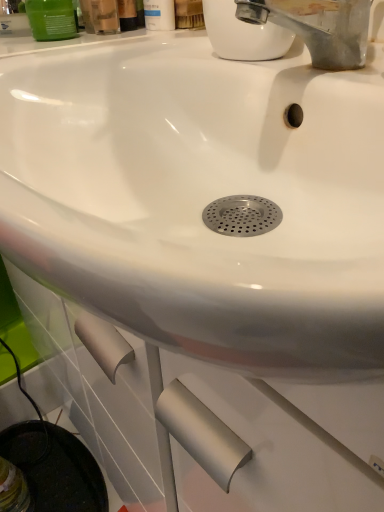
This screenshot has width=384, height=512. Describe the element at coordinates (100, 16) in the screenshot. I see `matte plastic mouthwash at upper center, positioned as the second mouthwash in left-to-right order` at that location.

Image resolution: width=384 pixels, height=512 pixels. What are the coordinates of `green matte container at upper left, marked as the 3th mouthwash in a right-to-left arrangement` in the screenshot? It's located at (51, 19).

Find the location of a particular element. The height and width of the screenshot is (512, 384). white matte bottle at upper center, the 1th mouthwash when ordered from right to left is located at coordinates (159, 15).

Is white matte bottle at upper center, the 1th mouthwash when ordered from right to left, touching green matte container at upper left, the 1th mouthwash positioned from the left?

There is a gap between white matte bottle at upper center, the 1th mouthwash when ordered from right to left, and green matte container at upper left, the 1th mouthwash positioned from the left.

Considering the relative sizes of white matte bottle at upper center, the 1th mouthwash when ordered from right to left, and green matte container at upper left, marked as the 3th mouthwash in a right-to-left arrangement, in the image provided, is white matte bottle at upper center, the 1th mouthwash when ordered from right to left, wider than green matte container at upper left, marked as the 3th mouthwash in a right-to-left arrangement,?

No.

From the image's perspective, starting from the white matte bottle at upper center, the 1th mouthwash when ordered from right to left, which mouthwash is the 2nd one below? Please provide its 2D coordinates.

[(51, 19)]

Between white matte bottle at upper center, the 1th mouthwash when ordered from right to left, and green matte container at upper left, marked as the 3th mouthwash in a right-to-left arrangement, which one has larger size?

Bigger between the two is white matte bottle at upper center, the 1th mouthwash when ordered from right to left.

Identify the location of mouthwash behind the green matte container at upper left, the 1th mouthwash positioned from the left. Image resolution: width=384 pixels, height=512 pixels. (159, 15).

Can you confirm if green matte container at upper left, the 1th mouthwash positioned from the left, is smaller than white matte bottle at upper center, the 1th mouthwash when ordered from right to left?

Yes, green matte container at upper left, the 1th mouthwash positioned from the left, is smaller than white matte bottle at upper center, the 1th mouthwash when ordered from right to left.

In the scene shown: Is green matte container at upper left, the 1th mouthwash positioned from the left, wider or thinner than white matte bottle at upper center, the 1th mouthwash when ordered from right to left?

Clearly, green matte container at upper left, the 1th mouthwash positioned from the left, has more width compared to white matte bottle at upper center, the 1th mouthwash when ordered from right to left.

Considering the relative positions of matte plastic mouthwash at upper center, positioned as the second mouthwash in left-to-right order, and green matte container at upper left, the 1th mouthwash positioned from the left, in the image provided, is matte plastic mouthwash at upper center, positioned as the second mouthwash in left-to-right order, in front of green matte container at upper left, the 1th mouthwash positioned from the left,?

Yes, it is in front of green matte container at upper left, the 1th mouthwash positioned from the left.

Who is bigger, matte plastic mouthwash at upper center, positioned as the second mouthwash in left-to-right order, or green matte container at upper left, the 1th mouthwash positioned from the left?

Bigger between the two is matte plastic mouthwash at upper center, positioned as the second mouthwash in left-to-right order.

Considering the sizes of objects matte plastic mouthwash at upper center, positioned as the second mouthwash in left-to-right order, and green matte container at upper left, marked as the 3th mouthwash in a right-to-left arrangement, in the image provided, who is taller, matte plastic mouthwash at upper center, positioned as the second mouthwash in left-to-right order, or green matte container at upper left, marked as the 3th mouthwash in a right-to-left arrangement,?

Standing taller between the two is matte plastic mouthwash at upper center, positioned as the second mouthwash in left-to-right order.

Does matte plastic mouthwash at upper center, arranged as the 2th mouthwash when viewed from the right, contain green matte container at upper left, marked as the 3th mouthwash in a right-to-left arrangement?

Definitely not — green matte container at upper left, marked as the 3th mouthwash in a right-to-left arrangement, is not inside matte plastic mouthwash at upper center, arranged as the 2th mouthwash when viewed from the right.

Could you tell me if matte plastic mouthwash at upper center, positioned as the second mouthwash in left-to-right order, is facing white matte bottle at upper center, placed as the third mouthwash when sorted from left to right?

No, matte plastic mouthwash at upper center, positioned as the second mouthwash in left-to-right order, is not turned towards white matte bottle at upper center, placed as the third mouthwash when sorted from left to right.

How different are the orientations of matte plastic mouthwash at upper center, positioned as the second mouthwash in left-to-right order, and white matte bottle at upper center, the 1th mouthwash when ordered from right to left, in degrees?

There is a 0.000144-degree angle between the facing directions of matte plastic mouthwash at upper center, positioned as the second mouthwash in left-to-right order, and white matte bottle at upper center, the 1th mouthwash when ordered from right to left.

Is matte plastic mouthwash at upper center, arranged as the 2th mouthwash when viewed from the right, outside of white matte bottle at upper center, placed as the third mouthwash when sorted from left to right?

That's correct, matte plastic mouthwash at upper center, arranged as the 2th mouthwash when viewed from the right, is outside of white matte bottle at upper center, placed as the third mouthwash when sorted from left to right.

Which of these two, matte plastic mouthwash at upper center, arranged as the 2th mouthwash when viewed from the right, or white matte bottle at upper center, placed as the third mouthwash when sorted from left to right, is smaller?

With smaller size is white matte bottle at upper center, placed as the third mouthwash when sorted from left to right.

Are green matte container at upper left, the 1th mouthwash positioned from the left, and matte plastic mouthwash at upper center, positioned as the second mouthwash in left-to-right order, located far from each other?

They are positioned close to each other.

From a real-world perspective, is green matte container at upper left, the 1th mouthwash positioned from the left, below matte plastic mouthwash at upper center, arranged as the 2th mouthwash when viewed from the right?

Yes, from a real-world perspective, green matte container at upper left, the 1th mouthwash positioned from the left, is under matte plastic mouthwash at upper center, arranged as the 2th mouthwash when viewed from the right.

Is green matte container at upper left, marked as the 3th mouthwash in a right-to-left arrangement, to the left of matte plastic mouthwash at upper center, positioned as the second mouthwash in left-to-right order, from the viewer's perspective?

Indeed, green matte container at upper left, marked as the 3th mouthwash in a right-to-left arrangement, is positioned on the left side of matte plastic mouthwash at upper center, positioned as the second mouthwash in left-to-right order.

Does point (49, 23) come farther from viewer compared to point (84, 5)?

No, it is in front of (84, 5).

Considering the relative positions of white matte bottle at upper center, the 1th mouthwash when ordered from right to left, and matte plastic mouthwash at upper center, positioned as the second mouthwash in left-to-right order, in the image provided, is white matte bottle at upper center, the 1th mouthwash when ordered from right to left, to the right of matte plastic mouthwash at upper center, positioned as the second mouthwash in left-to-right order, from the viewer's perspective?

Indeed, white matte bottle at upper center, the 1th mouthwash when ordered from right to left, is positioned on the right side of matte plastic mouthwash at upper center, positioned as the second mouthwash in left-to-right order.

Is white matte bottle at upper center, the 1th mouthwash when ordered from right to left, positioned before matte plastic mouthwash at upper center, positioned as the second mouthwash in left-to-right order?

No, white matte bottle at upper center, the 1th mouthwash when ordered from right to left, is further to the viewer.

Is point (173, 28) closer or farther from the camera than point (84, 9)?

Point (173, 28).

At what (x,y) coordinates should I click in order to perform the action: click on mouthwash that is the 2nd object located below the white matte bottle at upper center, the 1th mouthwash when ordered from right to left (from the image's perspective). Please return your answer as a coordinate pair (x, y). This screenshot has width=384, height=512. Looking at the image, I should click on (51, 19).

At what (x,y) coordinates should I click in order to perform the action: click on the 1st mouthwash in front when counting from the white matte bottle at upper center, placed as the third mouthwash when sorted from left to right. Please return your answer as a coordinate pair (x, y). The width and height of the screenshot is (384, 512). Looking at the image, I should click on (51, 19).

Considering their positions, is green matte container at upper left, the 1th mouthwash positioned from the left, positioned further to white matte bottle at upper center, the 1th mouthwash when ordered from right to left, than matte plastic mouthwash at upper center, positioned as the second mouthwash in left-to-right order?

green matte container at upper left, the 1th mouthwash positioned from the left, is further to white matte bottle at upper center, the 1th mouthwash when ordered from right to left.

Which object lies further to the anchor point matte plastic mouthwash at upper center, arranged as the 2th mouthwash when viewed from the right, white matte bottle at upper center, placed as the third mouthwash when sorted from left to right, or green matte container at upper left, the 1th mouthwash positioned from the left?

white matte bottle at upper center, placed as the third mouthwash when sorted from left to right.

Based on the photo, estimate the real-world distances between objects in this image. Which object is further from green matte container at upper left, the 1th mouthwash positioned from the left, white matte bottle at upper center, placed as the third mouthwash when sorted from left to right, or matte plastic mouthwash at upper center, arranged as the 2th mouthwash when viewed from the right?

white matte bottle at upper center, placed as the third mouthwash when sorted from left to right, is positioned further to the anchor green matte container at upper left, the 1th mouthwash positioned from the left.

Based on their spatial positions, is matte plastic mouthwash at upper center, positioned as the second mouthwash in left-to-right order, or white matte bottle at upper center, placed as the third mouthwash when sorted from left to right, closer to green matte container at upper left, marked as the 3th mouthwash in a right-to-left arrangement?

matte plastic mouthwash at upper center, positioned as the second mouthwash in left-to-right order, is closer to green matte container at upper left, marked as the 3th mouthwash in a right-to-left arrangement.

Based on their spatial positions, is matte plastic mouthwash at upper center, positioned as the second mouthwash in left-to-right order, or green matte container at upper left, marked as the 3th mouthwash in a right-to-left arrangement, further from white matte bottle at upper center, the 1th mouthwash when ordered from right to left?

green matte container at upper left, marked as the 3th mouthwash in a right-to-left arrangement.

Which object lies nearer to the anchor point matte plastic mouthwash at upper center, arranged as the 2th mouthwash when viewed from the right, green matte container at upper left, the 1th mouthwash positioned from the left, or white matte bottle at upper center, the 1th mouthwash when ordered from right to left?

green matte container at upper left, the 1th mouthwash positioned from the left, is closer to matte plastic mouthwash at upper center, arranged as the 2th mouthwash when viewed from the right.

The image size is (384, 512). I want to click on mouthwash between green matte container at upper left, marked as the 3th mouthwash in a right-to-left arrangement, and white matte bottle at upper center, placed as the third mouthwash when sorted from left to right, so click(x=100, y=16).